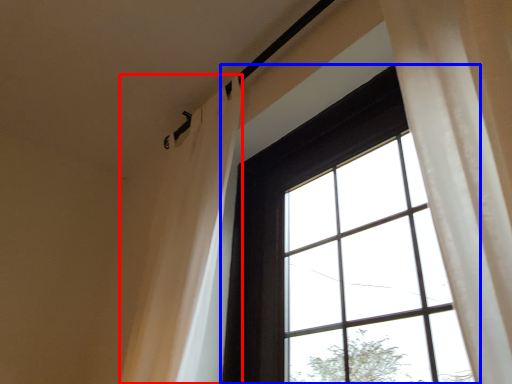
Question: Among these objects, which one is nearest to the camera, shower curtain (highlighted by a red box) or window (highlighted by a blue box)?

Choices:
 (A) shower curtain
 (B) window

Answer: (B)